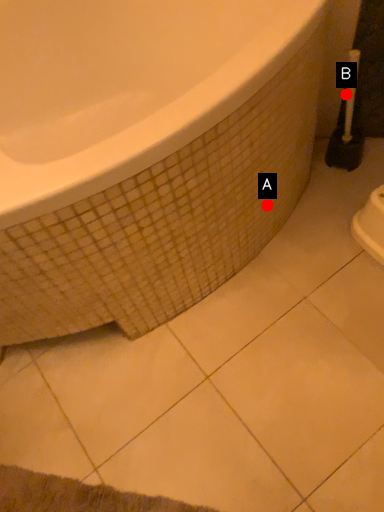
Question: Two points are circled on the image, labeled by A and B beside each circle. Among these points, which one is farthest from the camera?

Choices:
 (A) A is further
 (B) B is further

Answer: (B)